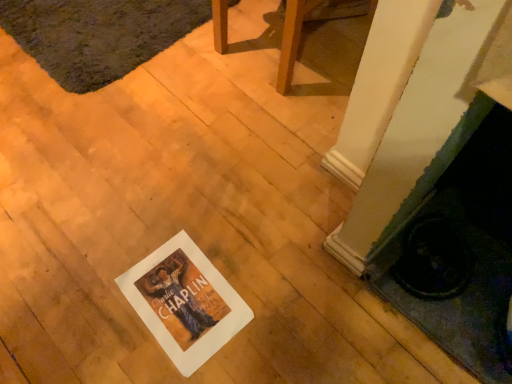
Where is `free space between wooden chair at center and white paper at center`? This screenshot has height=384, width=512. free space between wooden chair at center and white paper at center is located at coordinates (242, 159).